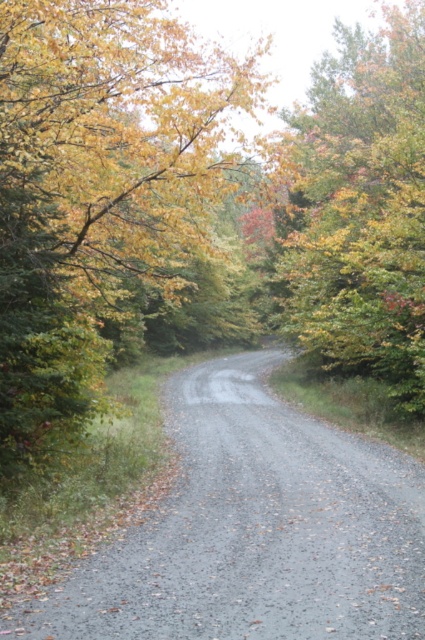
Question: Considering the real-world distances, which object is closest to the yellow-green foliage at center?

Choices:
 (A) gray gravel path at center
 (B) autumn leaves at upper right

Answer: (B)

Question: Can you confirm if gray gravel path at center is positioned to the right of autumn leaves at upper right?

Choices:
 (A) no
 (B) yes

Answer: (A)

Question: Does yellow-green foliage at center have a greater width compared to autumn leaves at upper right?

Choices:
 (A) yes
 (B) no

Answer: (A)

Question: Does yellow-green foliage at center appear on the right side of autumn leaves at upper right?

Choices:
 (A) no
 (B) yes

Answer: (A)

Question: Which point appears closest to the camera in this image?

Choices:
 (A) (214, 157)
 (B) (376, 193)

Answer: (B)

Question: Which point appears closest to the camera in this image?

Choices:
 (A) tap(360, 630)
 (B) tap(357, 148)

Answer: (A)